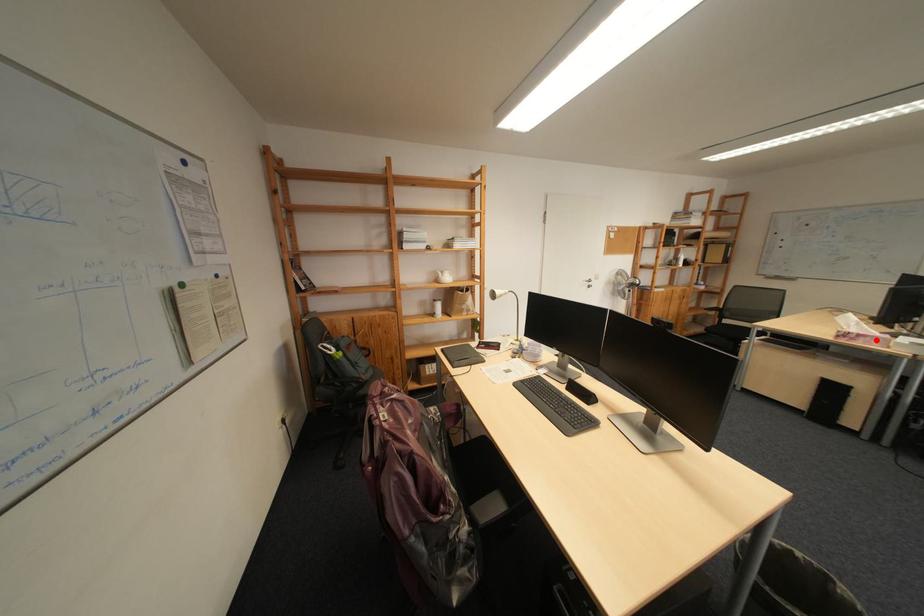
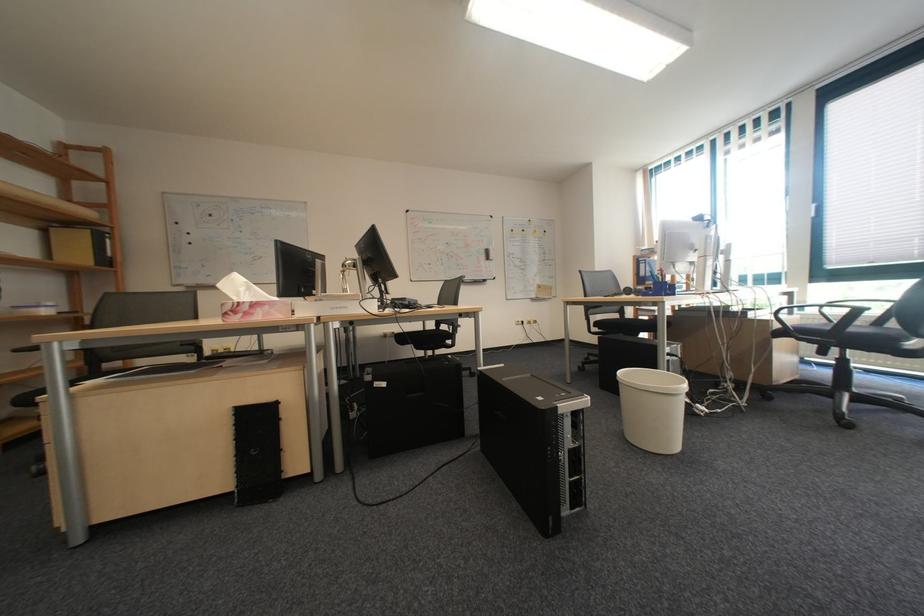
Find the pixel in the second image that matches the highlighted location in the first image.

(273, 312)